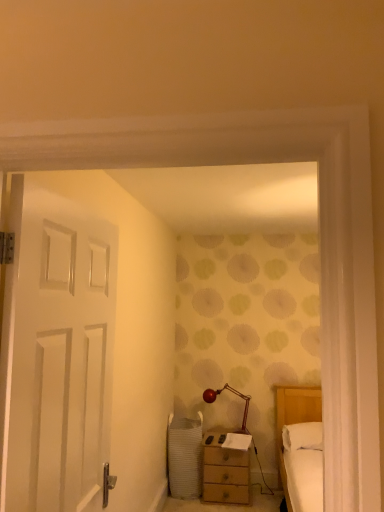
Question: Does point (248, 396) appear closer or farther from the camera than point (304, 448)?

Choices:
 (A) farther
 (B) closer

Answer: (A)

Question: From a real-world perspective, relative to white soft pillow at right, is shiny red glass table lamp at center vertically above or below?

Choices:
 (A) below
 (B) above

Answer: (B)

Question: Based on their relative distances, which object is nearer to the white soft pillow at right?

Choices:
 (A) wooden nightstand at lower center
 (B) white matte door at left
 (C) shiny red glass table lamp at center

Answer: (A)

Question: Which object is the farthest from the white matte door at left?

Choices:
 (A) white soft pillow at right
 (B) wooden nightstand at lower center
 (C) shiny red glass table lamp at center

Answer: (C)